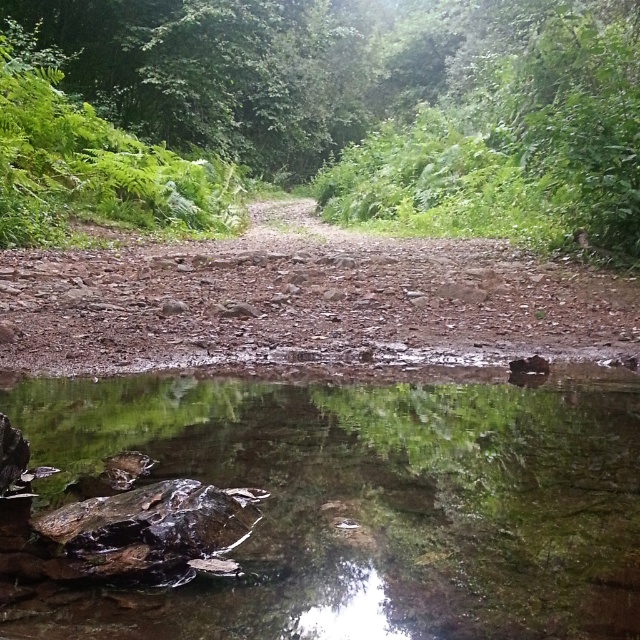
Question: Which object appears closest to the camera in this image?

Choices:
 (A) dull brown gravel at center
 (B) green leafy tree at center
 (C) clear water at center

Answer: (C)

Question: Estimate the real-world distances between objects in this image. Which object is closer to the dull brown gravel at center?

Choices:
 (A) clear water at center
 (B) green leafy tree at center

Answer: (A)

Question: Which of the following is the closest to the observer?

Choices:
 (A) dull brown gravel at center
 (B) clear water at center

Answer: (B)

Question: Can you confirm if clear water at center is positioned above green leafy tree at center?

Choices:
 (A) no
 (B) yes

Answer: (A)

Question: Can you confirm if green leafy tree at center is positioned to the right of dull brown gravel at center?

Choices:
 (A) no
 (B) yes

Answer: (A)

Question: Is green leafy tree at center further to camera compared to dull brown gravel at center?

Choices:
 (A) yes
 (B) no

Answer: (A)